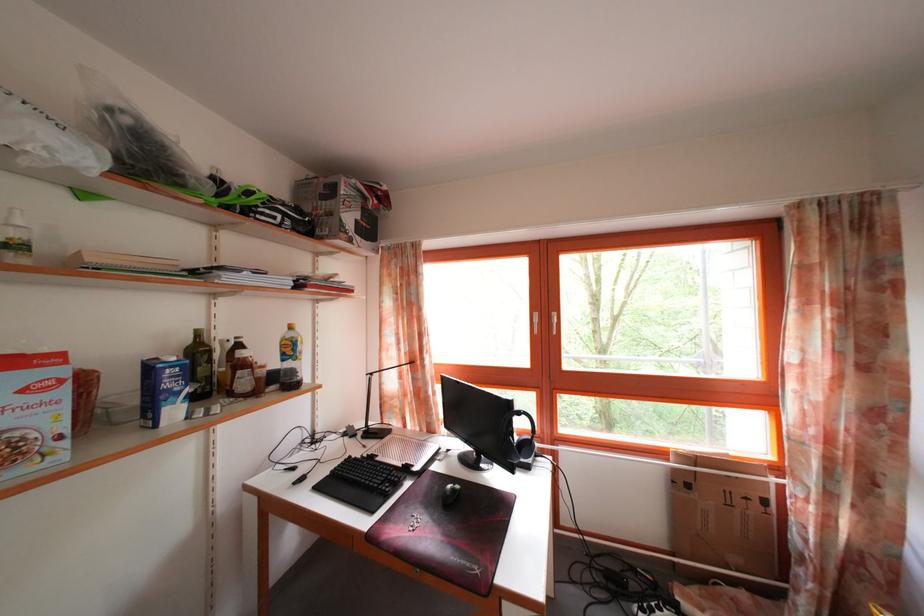
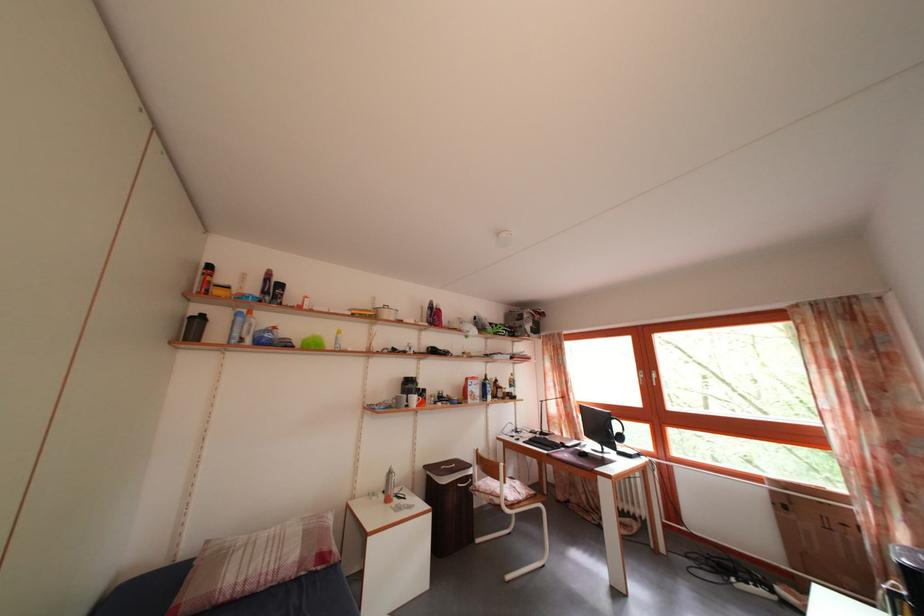
Locate, in the second image, the point that corresponds to (x=375, y=440) in the first image.

(550, 440)